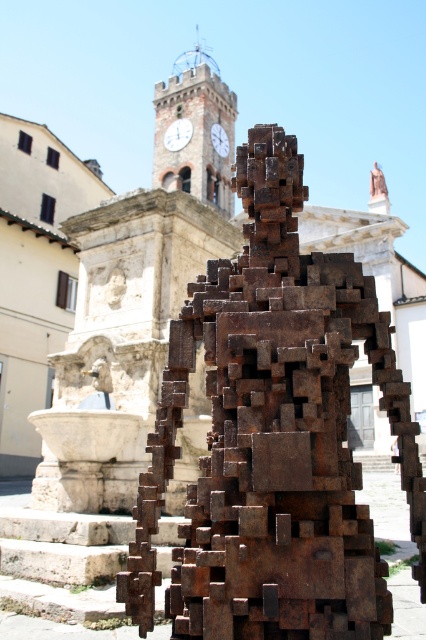
Question: Which point is farther from the camera taking this photo?

Choices:
 (A) (187, 134)
 (B) (222, 152)

Answer: (B)

Question: Which of the following is the farthest from the observer?

Choices:
 (A) (186, 122)
 (B) (201, 49)
 (C) (213, 136)
 (D) (304, 353)

Answer: (B)

Question: Can you confirm if rustic stone clock tower at upper center is bigger than rustic metal clock at center?

Choices:
 (A) no
 (B) yes

Answer: (B)

Question: Among these points, which one is nearest to the camera?

Choices:
 (A) (199, 65)
 (B) (213, 310)

Answer: (B)

Question: Can you confirm if rusty metal sculpture at center is thinner than rustic metal clock at center?

Choices:
 (A) no
 (B) yes

Answer: (A)

Question: Can you confirm if rusty metal sculpture at center is positioned to the right of rustic metal clock at center?

Choices:
 (A) yes
 (B) no

Answer: (A)